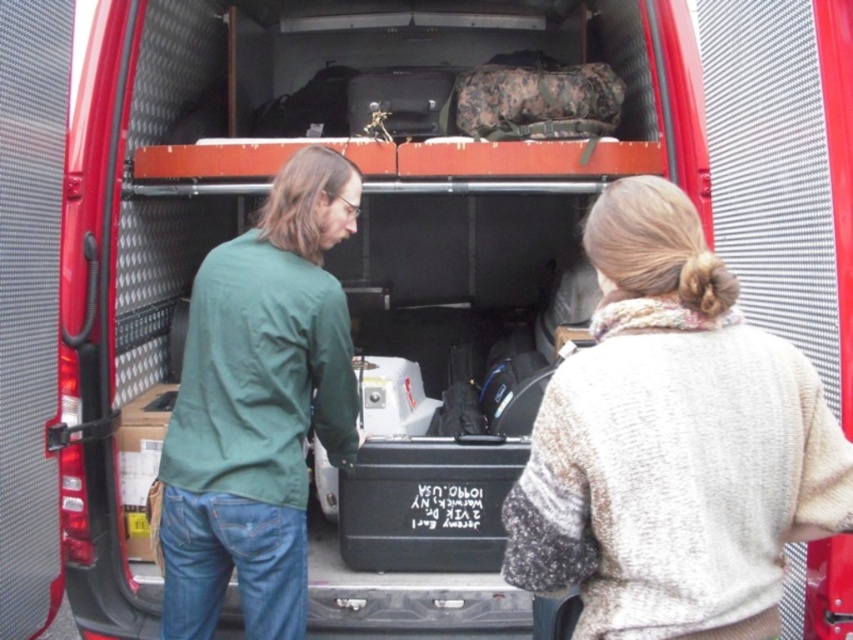
You are trying to decide which item to grab first from the van. Based on their sizes, which one could you reach more easily, the knitted beige sweater at center or the green matte jacket at center?

The knitted beige sweater at center might be wider than the green matte jacket at center, so it could be easier to reach due to its larger size.

You are standing in front of the red van and want to reach both points inside the cargo area. Which point, point [830,499] or point [300,307], is closer to you?

Point [830,499] is closer to the viewer than point [300,307].

You are a photographer trying to capture a detailed shot of the knitted beige sweater at center and the green matte shirt at center. Which one should you focus on first if you want to ensure both are in focus without adjusting the camera settings?

The knitted beige sweater at center should be focused on first because it is closer to the viewer than the green matte shirt at center. By focusing on the closer object, the farther one may still be within the depth of field.